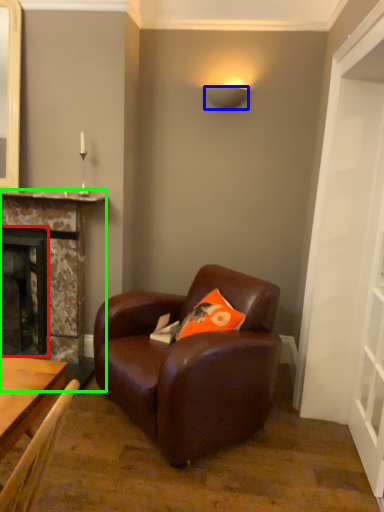
Question: Which object is the closest to the fireplace (highlighted by a red box)? Choose among these: lamp (highlighted by a blue box) or fireplace (highlighted by a green box).

Choices:
 (A) lamp
 (B) fireplace

Answer: (B)